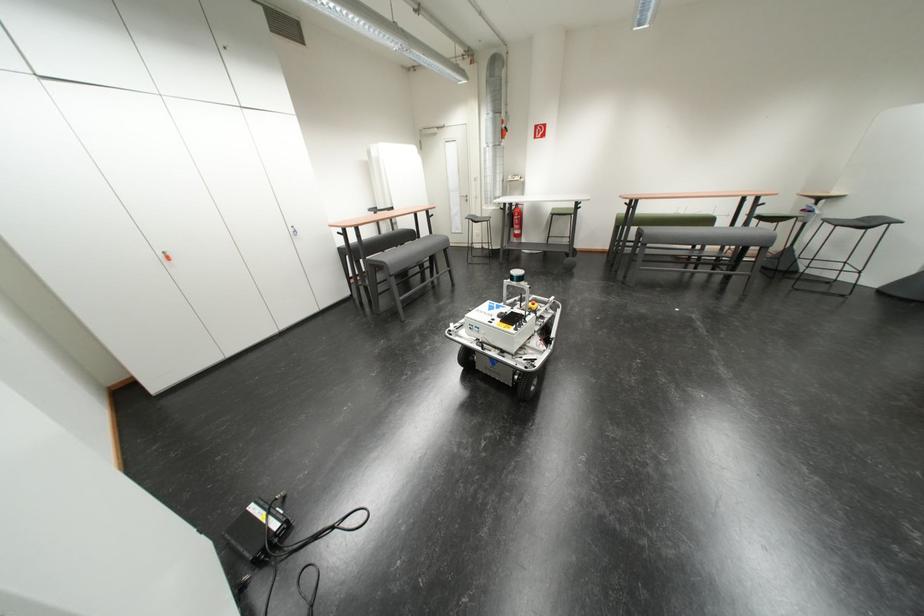
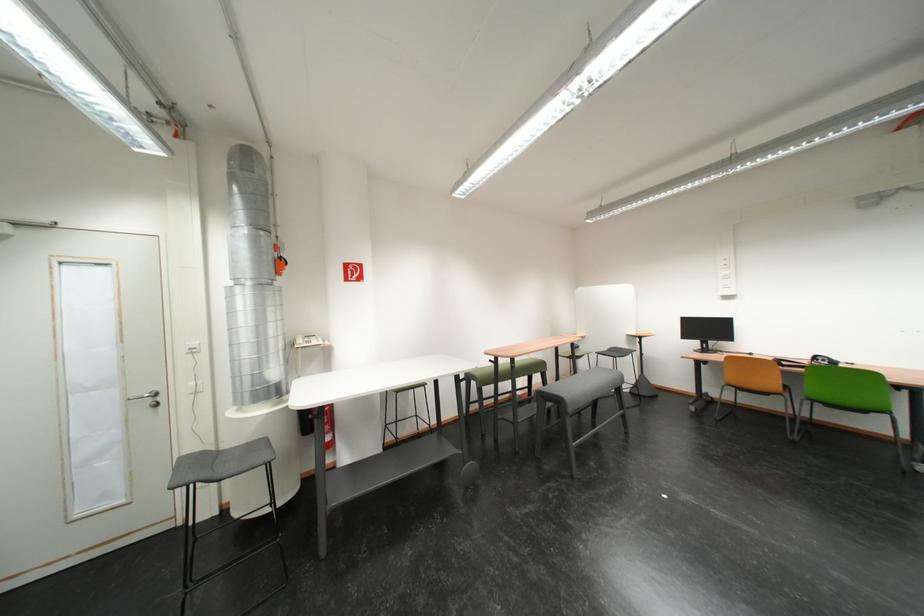
In the second image, find the point that corresponds to the point at 480,220 in the first image.

(203, 480)